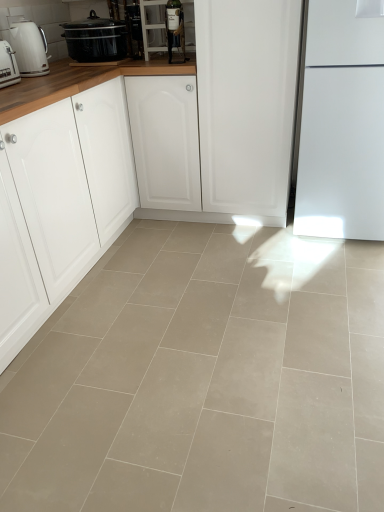
The height and width of the screenshot is (512, 384). In order to click on vacant area that lies to the right of white plastic toaster at left, arranged as the 1th kitchen appliance when viewed from the front in this screenshot , I will do 44,83.